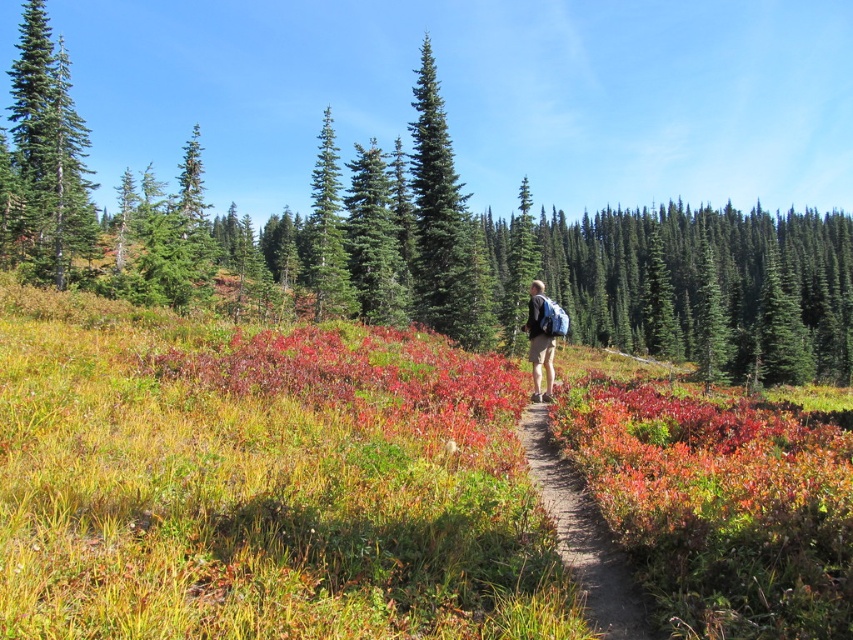
You are standing at the starting point of the dirt path and want to reach the green matte evergreen tree at left. Which direction should you walk to get there?

The green matte evergreen tree at left is located at point (48, 154), so you should walk towards the left side of the scene to reach it.

You are planning to set up a small tent for a quick rest during your hike. The tent requires a flat area larger than the brown dirt path at center. Based on the scene, can you determine if the green grassy at center is suitable for setting up the tent?

The green grassy at center is larger in size than the brown dirt path at center, so yes, the green grassy at center is suitable for setting up the tent as it provides a larger flat area required by the tent.

You are a hiker planning to walk along the brown dirt path at center while carrying the matte blue backpack at center. Based on the scene, will the backpack interfere with your view of the path ahead?

The brown dirt path at center is positioned under matte blue backpack at center, so the backpack may block your view of the path ahead.